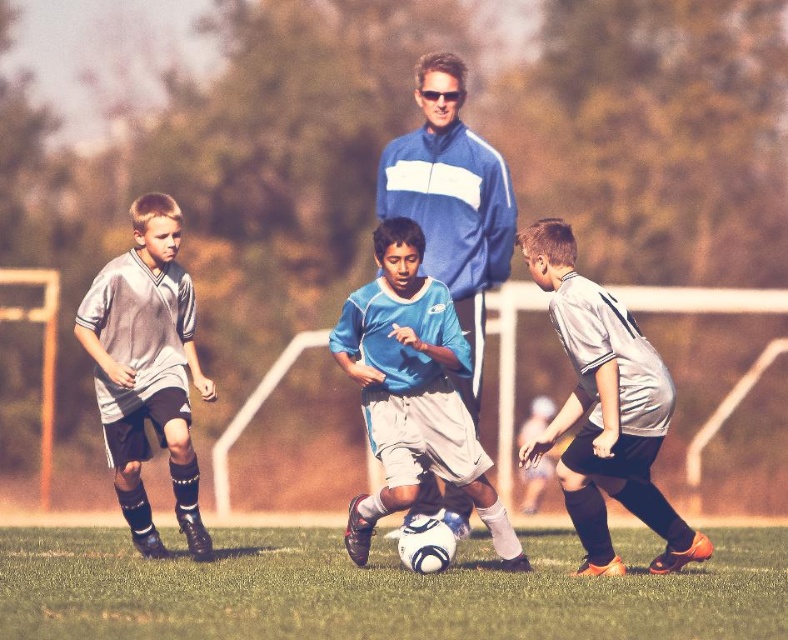
Does point (673, 513) come farther from viewer compared to point (508, 221)?

That is False.

Which is in front, point (563, 317) or point (448, 218)?

Point (563, 317) is more forward.

This screenshot has width=788, height=640. Describe the element at coordinates (604, 410) in the screenshot. I see `gray matte jersey at right` at that location.

This screenshot has width=788, height=640. Find the location of `gray matte jersey at right`. gray matte jersey at right is located at coordinates (604, 410).

Is green grass at center thinner than gray matte soccer jersey at left?

Indeed, green grass at center has a lesser width compared to gray matte soccer jersey at left.

Who is taller, green grass at center or gray matte soccer jersey at left?

Standing taller between the two is gray matte soccer jersey at left.

Where is `green grass at center`? The height and width of the screenshot is (640, 788). green grass at center is located at coordinates (381, 589).

The width and height of the screenshot is (788, 640). What are the coordinates of `green grass at center` in the screenshot? It's located at (381, 589).

Can you confirm if green grass at center is positioned to the right of white matte soccer ball at center?

Correct, you'll find green grass at center to the right of white matte soccer ball at center.

Is point (522, 577) closer to viewer compared to point (407, 163)?

Yes, it is.

Where is `green grass at center`? green grass at center is located at coordinates (381, 589).